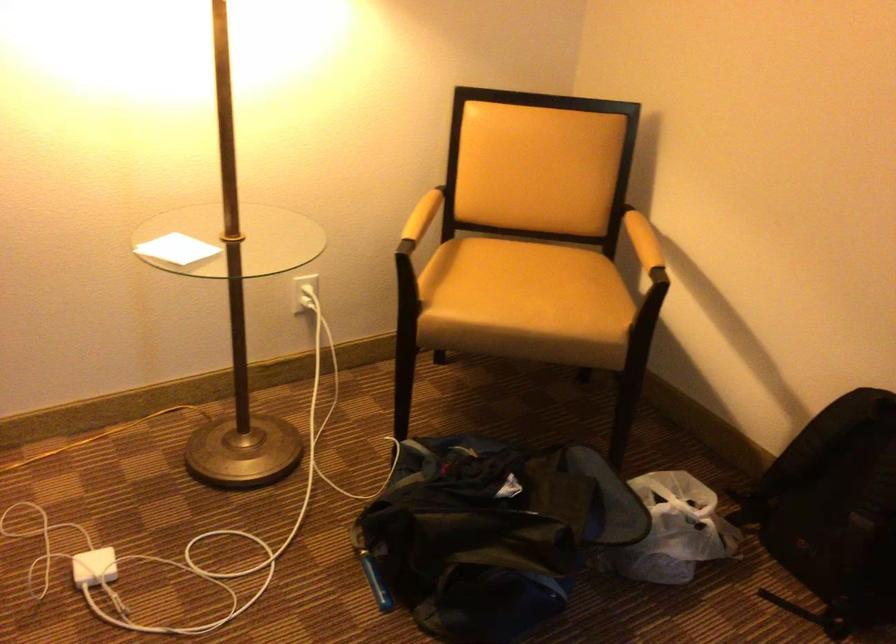
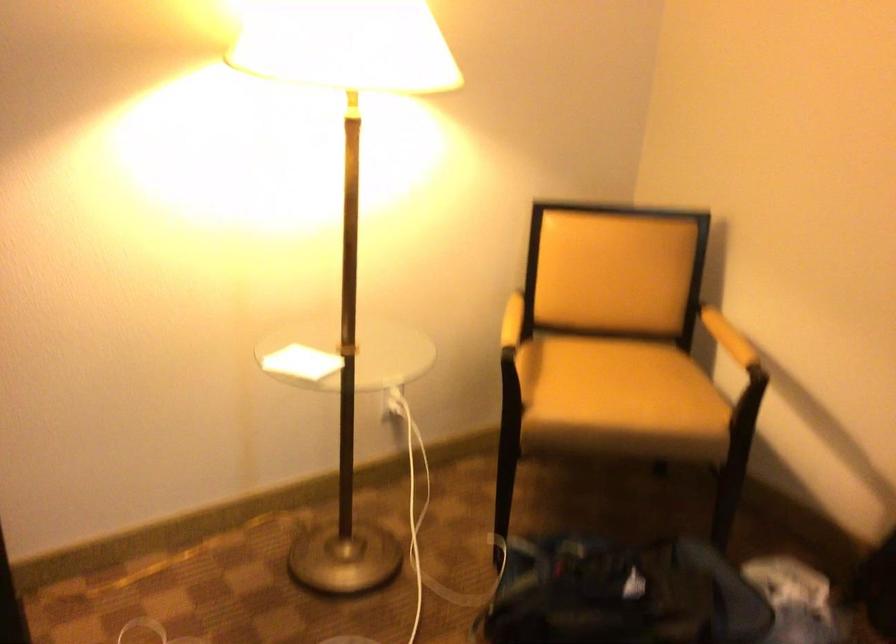
The point at (419, 218) is marked in the first image. Where is the corresponding point in the second image?

(512, 321)